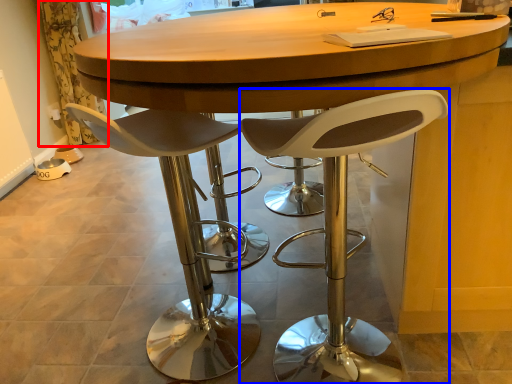
Question: Which point is closer to the camera, curtain (highlighted by a red box) or chair (highlighted by a blue box)?

Choices:
 (A) curtain
 (B) chair

Answer: (B)